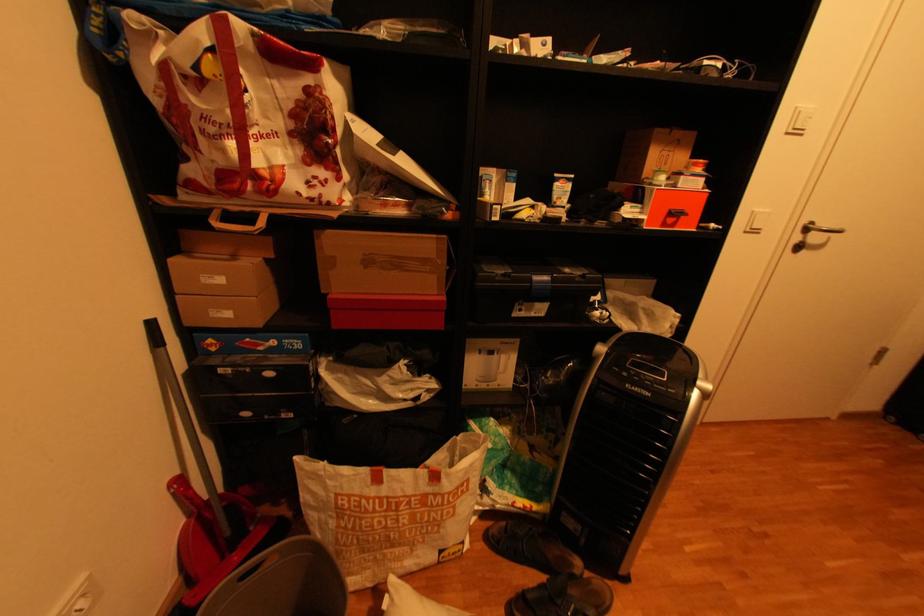
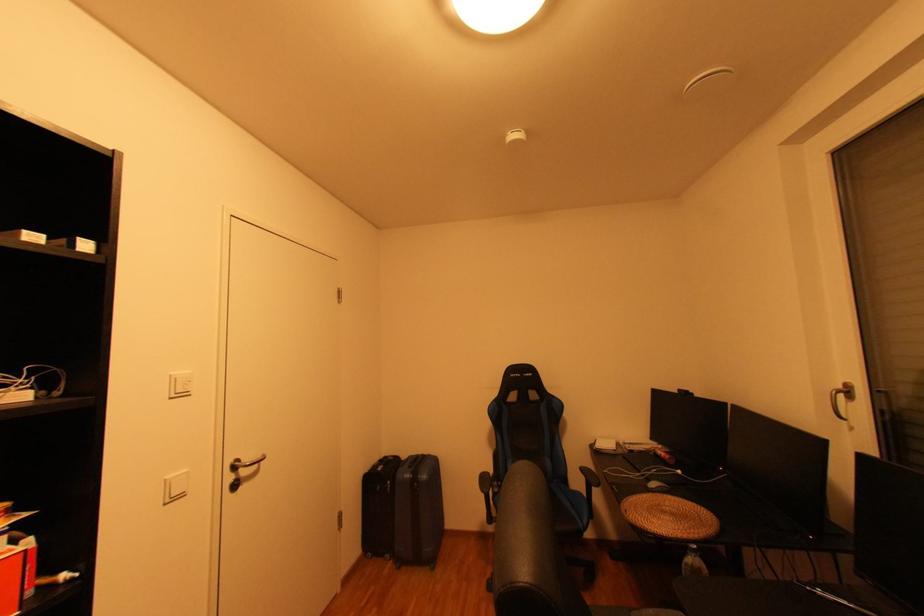
The point at (808, 111) is marked in the first image. Where is the corresponding point in the second image?

(185, 379)